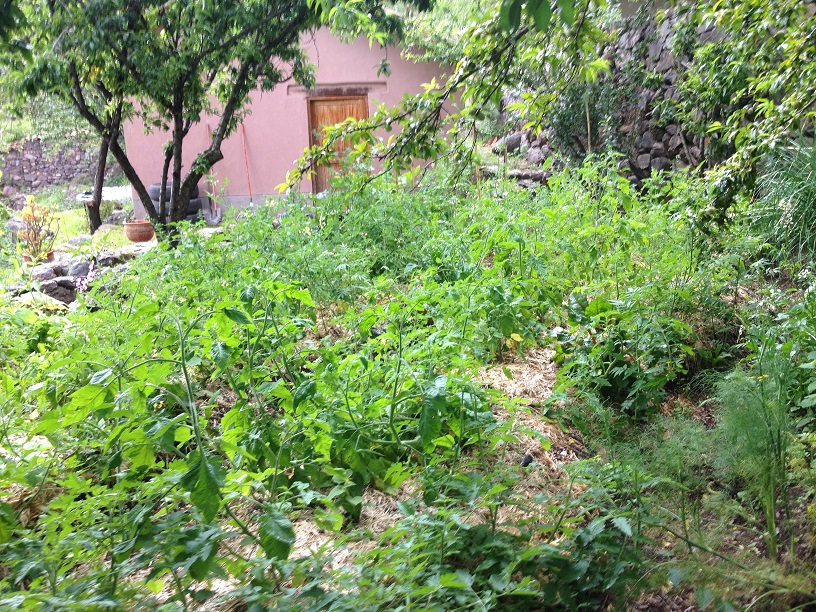
Where is `pink wall`? pink wall is located at coordinates [273, 131].